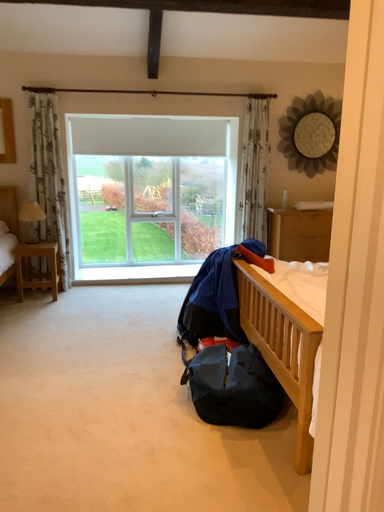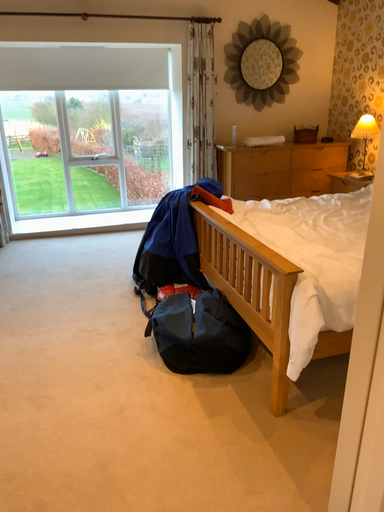
Question: How did the camera likely rotate when shooting the video?

Choices:
 (A) rotated downward
 (B) rotated upward

Answer: (A)